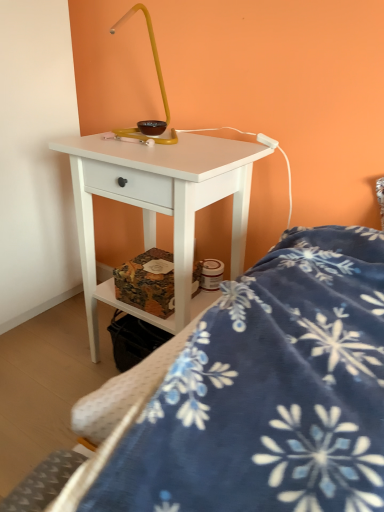
Question: From the image's perspective, is blue fleece blanket at lower right above or below white matte nightstand at center?

Choices:
 (A) above
 (B) below

Answer: (B)

Question: Considering their positions, is blue fleece blanket at lower right located in front of or behind white matte nightstand at center?

Choices:
 (A) front
 (B) behind

Answer: (A)

Question: Based on their positions, is blue fleece blanket at lower right located to the left or right of white matte nightstand at center?

Choices:
 (A) left
 (B) right

Answer: (B)

Question: Is point (185, 276) positioned closer to the camera than point (23, 484)?

Choices:
 (A) farther
 (B) closer

Answer: (A)

Question: Relative to blue fleece blanket at lower right, is white matte nightstand at center in front or behind?

Choices:
 (A) front
 (B) behind

Answer: (B)

Question: From a real-world perspective, is white matte nightstand at center physically located above or below blue fleece blanket at lower right?

Choices:
 (A) above
 (B) below

Answer: (B)

Question: In terms of size, does white matte nightstand at center appear bigger or smaller than blue fleece blanket at lower right?

Choices:
 (A) big
 (B) small

Answer: (A)